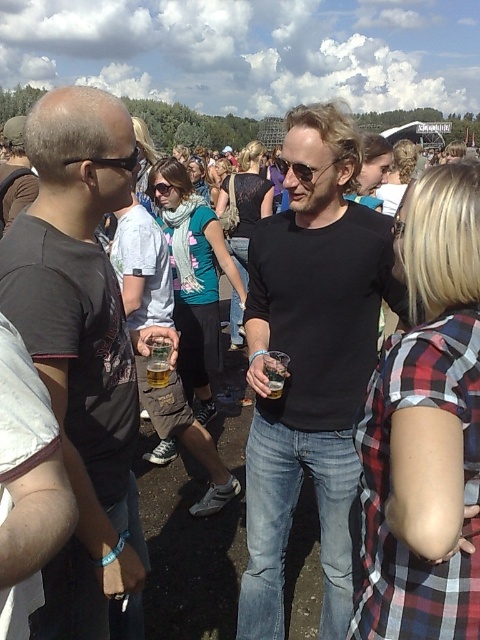
Who is positioned more to the right, matte black t-shirt at left or matte black sunglasses at left?

matte black sunglasses at left

Who is shorter, matte black t-shirt at left or matte black sunglasses at left?

matte black sunglasses at left is shorter.

Find the location of a particular element. The width and height of the screenshot is (480, 640). matte black t-shirt at left is located at coordinates (82, 356).

I want to click on matte black t-shirt at left, so click(82, 356).

Is the position of black matte shirt at center more distant than that of translucent glass beer at center?

No, it is in front of translucent glass beer at center.

Which is in front, point (342, 634) or point (155, 356)?

Point (155, 356) is in front.

Image resolution: width=480 pixels, height=640 pixels. In order to click on black matte shirt at center in this screenshot , I will do `click(311, 362)`.

Does translucent glass beer at center appear over translucent plastic cup at center?

Indeed, translucent glass beer at center is positioned over translucent plastic cup at center.

From the picture: Which of these two, translucent glass beer at center or translucent plastic cup at center, stands taller?

translucent glass beer at center

This screenshot has width=480, height=640. What do you see at coordinates (158, 362) in the screenshot?
I see `translucent glass beer at center` at bounding box center [158, 362].

The height and width of the screenshot is (640, 480). What are the coordinates of `translucent glass beer at center` in the screenshot? It's located at (158, 362).